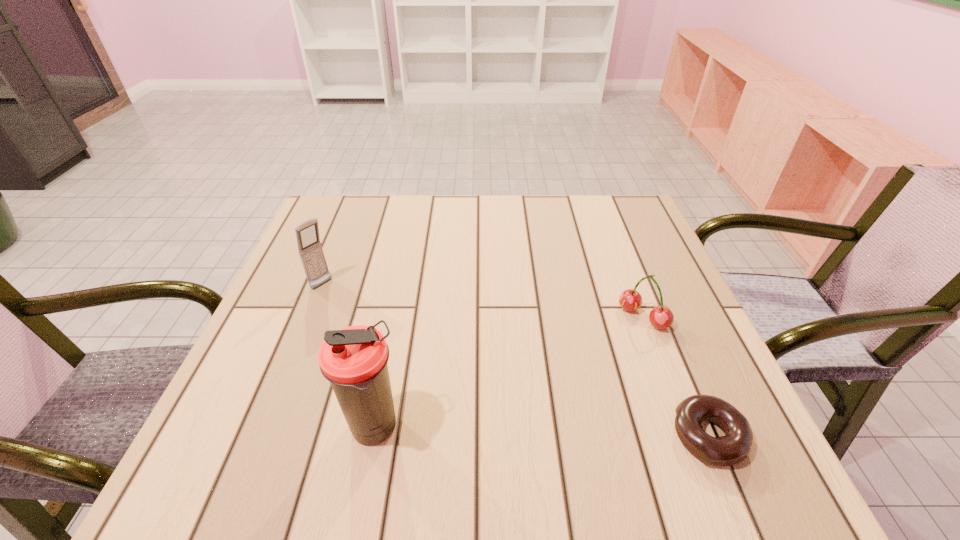
I want to click on free space located on the front-facing side of the cellular telephone, so click(x=390, y=335).

Find the location of a particular element. vacant region located 0.180m on the front-facing side of the cellular telephone is located at coordinates [380, 328].

The image size is (960, 540). What are the coordinates of `free space located 0.280m with stems pointing upwards on the second farthest object` in the screenshot? It's located at (539, 411).

Find the location of a particular element. Image resolution: width=960 pixels, height=540 pixels. free space located 0.330m with stems pointing upwards on the second farthest object is located at coordinates (518, 430).

Find the location of a particular element. This screenshot has height=540, width=960. vacant space located with stems pointing upwards on the second farthest object is located at coordinates (608, 349).

At what (x,y) coordinates should I click in order to perform the action: click on thermos bottle that is positioned at the near edge. Please return your answer as a coordinate pair (x, y). This screenshot has height=540, width=960. Looking at the image, I should click on click(354, 359).

This screenshot has width=960, height=540. In order to click on doughnut that is positioned at the near edge in this screenshot , I will do `click(735, 446)`.

The image size is (960, 540). Find the location of `object that is at the left edge`. object that is at the left edge is located at coordinates (311, 253).

Locate an element on the screen. The image size is (960, 540). doughnut that is at the right edge is located at coordinates click(x=735, y=446).

Find the location of a particular element. The height and width of the screenshot is (540, 960). cherry positioned at the right edge is located at coordinates (661, 317).